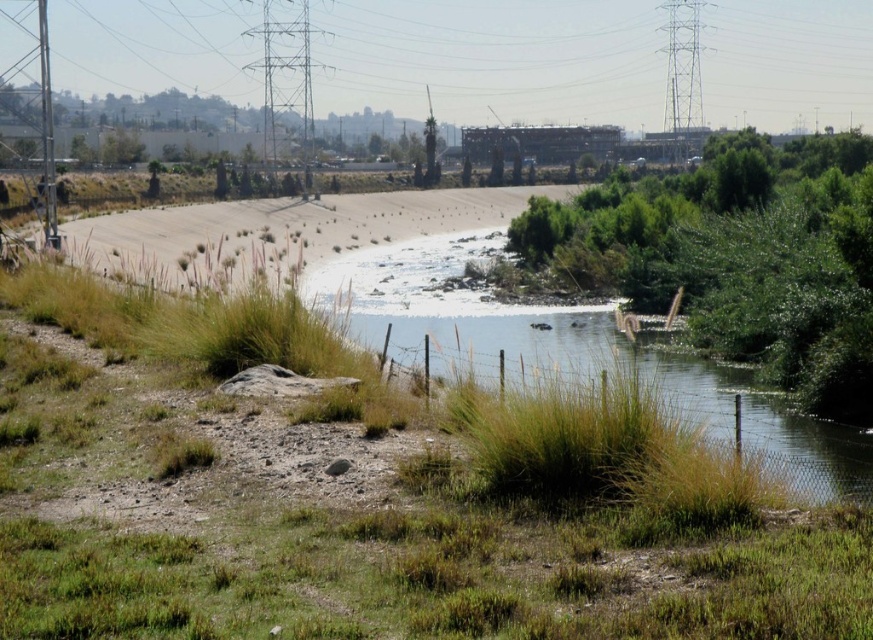
You are a gardener who wants to plant new flowers in the green grass at center and green grassy river at center. Which area would require less soil to cover the roots properly?

The green grass at center has a lesser height compared to the green grassy river at center, so it would require less soil to cover the roots properly.

You are standing at the point marked by the coordinates point (376, 499) in the image. Based on the scene description, what type of terrain are you likely standing on?

The point (376, 499) indicates green grass at center, so you are likely standing on green grass.

You are standing on the path and see the green grass at center and the green grassy river at center. Which one is closer to the ground?

The green grass at center is positioned under the green grassy river at center, so the green grass at center is closer to the ground.